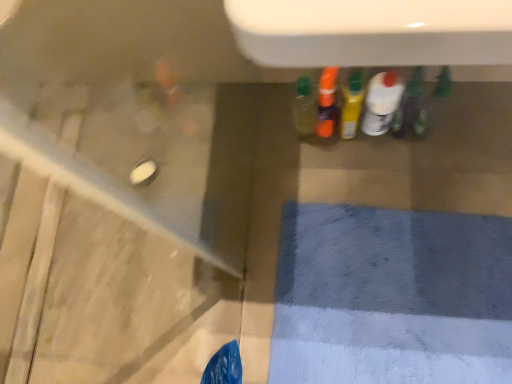
Image resolution: width=512 pixels, height=384 pixels. In order to click on free space in front of translucent plastic bottle at center, placed as the first bottle when sorted from left to right in this screenshot , I will do `click(331, 169)`.